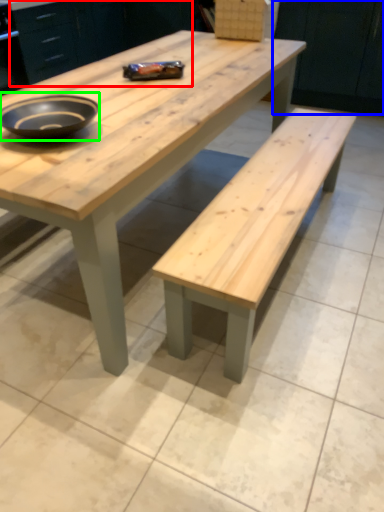
Question: Considering the real-world distances, which object is farthest from cabinetry (highlighted by a red box)? cabinetry (highlighted by a blue box) or bowl (highlighted by a green box)?

Choices:
 (A) cabinetry
 (B) bowl

Answer: (B)